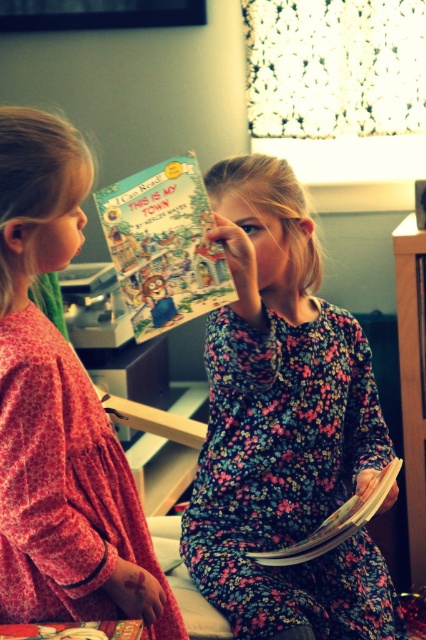
Who is positioned more to the left, floral-patterned dress at center or matte paper book at center?

matte paper book at center is more to the left.

Which is behind, point (195, 563) or point (210, 301)?

The point (195, 563) is more distant.

I want to click on floral-patterned dress at center, so click(284, 428).

Is floral-patterned dress at center bigger than floral pajamas at left?

Yes, floral-patterned dress at center is bigger than floral pajamas at left.

Between floral-patterned dress at center and floral pajamas at left, which one is positioned lower?

floral-patterned dress at center

Who is more forward, (253, 500) or (25, 595)?

Point (25, 595) is more forward.

Find the location of `floral-patterned dress at center`. floral-patterned dress at center is located at coordinates (284, 428).

Is matte paper book at center shorter than floral-patterned book at center?

In fact, matte paper book at center may be taller than floral-patterned book at center.

Which is more to the left, matte paper book at center or floral-patterned book at center?

matte paper book at center is more to the left.

The width and height of the screenshot is (426, 640). Identify the location of matte paper book at center. (164, 244).

You are a GUI agent. You are given a task and a screenshot of the screen. Output one action in this format:
    pyautogui.click(x=<x>, y=<y>)
    Task: Click on the matte paper book at center
    The height and width of the screenshot is (640, 426).
    Given the screenshot: What is the action you would take?
    pyautogui.click(x=164, y=244)